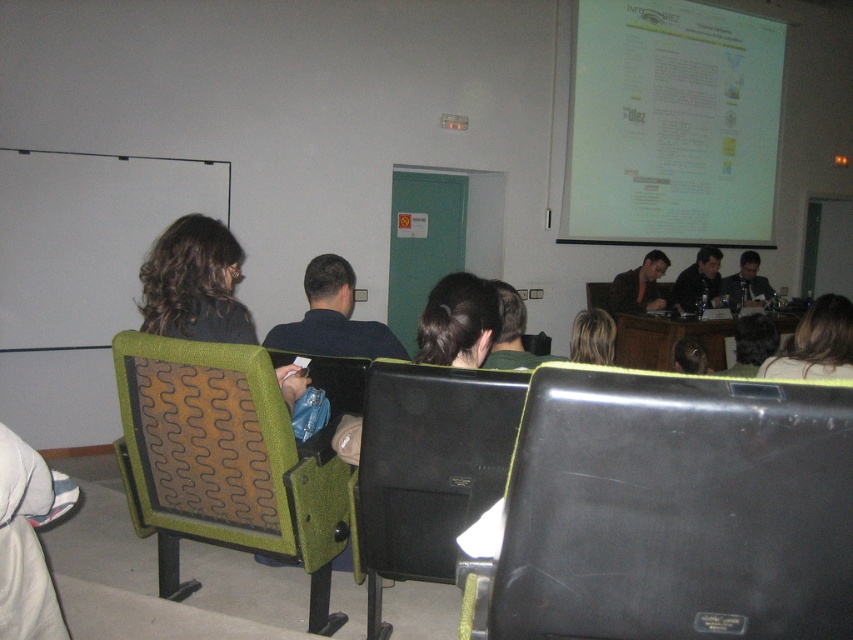
Between green fabric chair at center and blonde hair at right, which one appears on the left side from the viewer's perspective?

Positioned to the left is green fabric chair at center.

Can you confirm if green fabric chair at center is taller than blonde hair at right?

Yes.

The height and width of the screenshot is (640, 853). What do you see at coordinates (225, 461) in the screenshot?
I see `green fabric chair at center` at bounding box center [225, 461].

Find the location of a particular element. Image resolution: width=853 pixels, height=640 pixels. green fabric chair at center is located at coordinates (225, 461).

Between blonde hair at right and dark suit jacket at right, which one is positioned higher?

dark suit jacket at right

Between blonde hair at right and dark suit jacket at right, which one is positioned lower?

blonde hair at right is below.

Is point (843, 362) positioned behind point (730, 289)?

No, it is not.

This screenshot has width=853, height=640. What are the coordinates of `blonde hair at right` in the screenshot? It's located at (816, 342).

Who is higher up, white paper at upper right or black fabric chair at center?

Positioned higher is white paper at upper right.

Find the location of a particular element. white paper at upper right is located at coordinates (671, 124).

This screenshot has width=853, height=640. Identify the location of white paper at upper right. (671, 124).